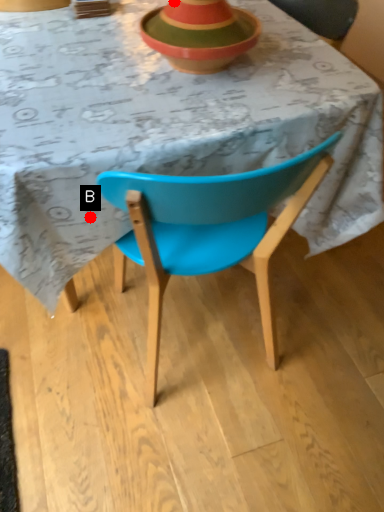
Question: Two points are circled on the image, labeled by A and B beside each circle. Which point appears closest to the camera in this image?

Choices:
 (A) A is closer
 (B) B is closer

Answer: (B)